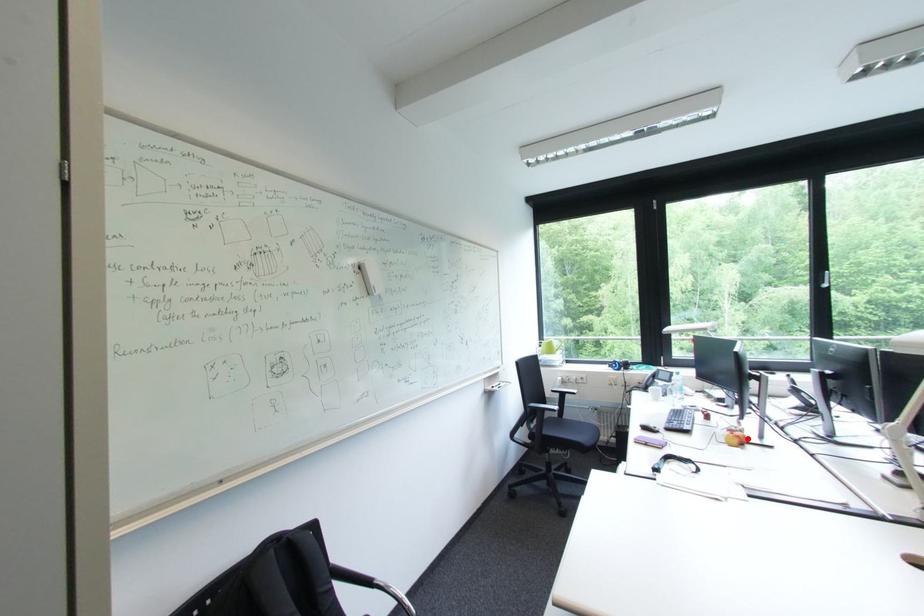
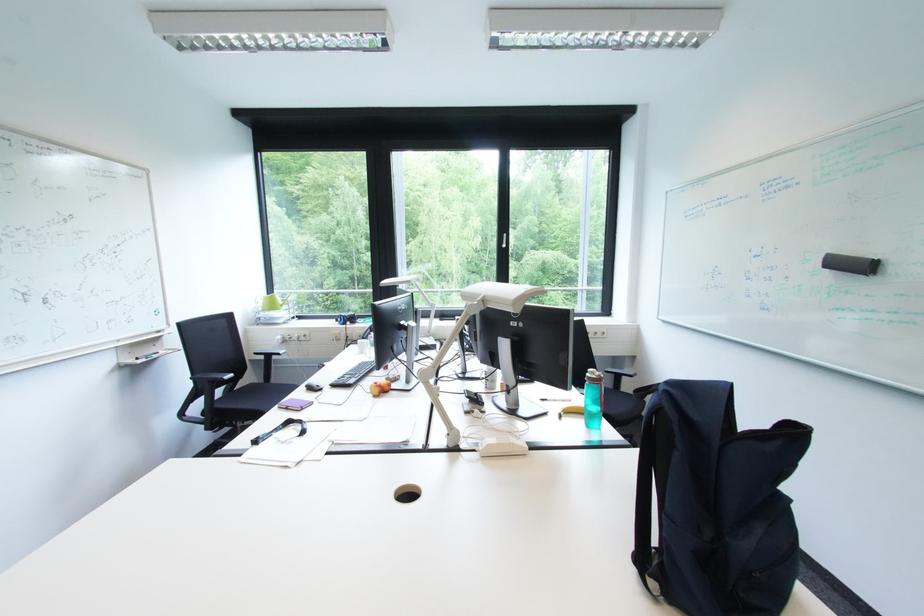
Question: I am providing you with two images of the same scene from different viewpoints. A red point is marked on the first image. Can you still see the location of the red point in image 2?

Choices:
 (A) Yes
 (B) No

Answer: (A)